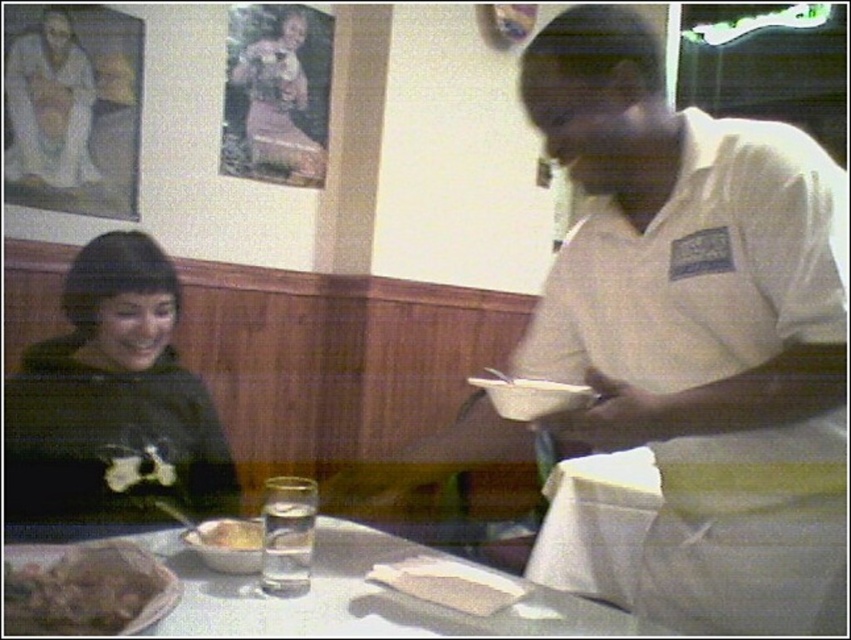
Who is positioned more to the left, black matte jacket at left or matte white shirt at upper left?

matte white shirt at upper left

Which is behind, point (161, 348) or point (23, 90)?

The point (23, 90) is behind.

I want to click on black matte jacket at left, so click(112, 401).

Is brown crumbly bread at lower left to the right of matte white shirt at upper left from the viewer's perspective?

Indeed, brown crumbly bread at lower left is positioned on the right side of matte white shirt at upper left.

You are a GUI agent. You are given a task and a screenshot of the screen. Output one action in this format:
    pyautogui.click(x=<x>, y=<y>)
    Task: Click on the brown crumbly bread at lower left
    Image resolution: width=851 pixels, height=640 pixels.
    Given the screenshot: What is the action you would take?
    pyautogui.click(x=84, y=589)

Can you confirm if white glossy table at lower center is thinner than yellowish matte rice bowl at lower left?

Incorrect, white glossy table at lower center's width is not less than yellowish matte rice bowl at lower left's.

The width and height of the screenshot is (851, 640). In order to click on white glossy table at lower center in this screenshot , I will do `click(355, 596)`.

Where is `white glossy table at lower center`? This screenshot has width=851, height=640. white glossy table at lower center is located at coordinates (355, 596).